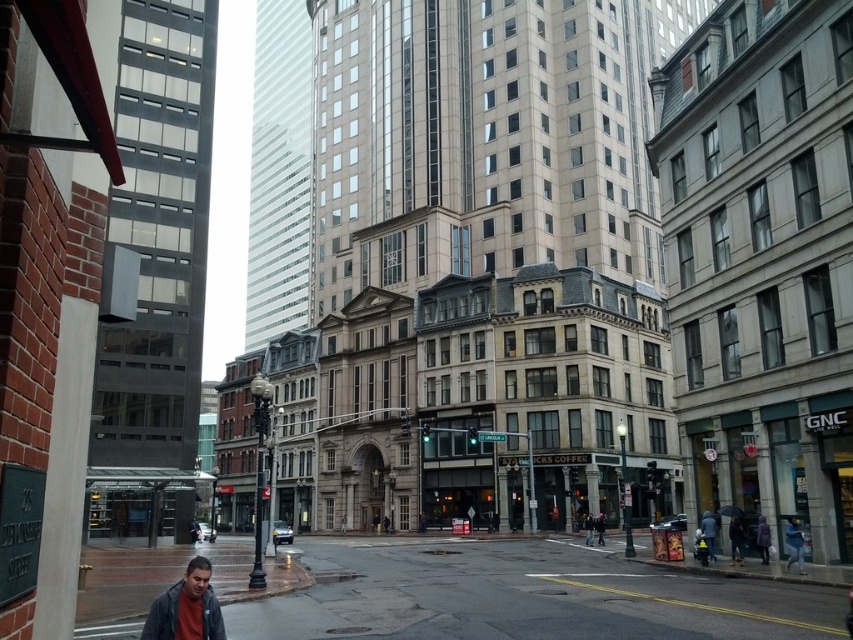
You are a delivery person trying to park your bike. You see the dark gray asphalt at lower center and the purple matte coat at lower right. Which surface can accommodate your bike for parking?

The dark gray asphalt at lower center is bigger than the purple matte coat at lower right, so the bike can be parked on the dark gray asphalt at lower center.

In the scene shown: You are a delivery person trying to cross the street. You see the dark gray asphalt at lower center and the dark gray jacket at lower left. Which one is wider from your perspective?

The dark gray asphalt at lower center might be wider than dark gray jacket at lower left according to the description.